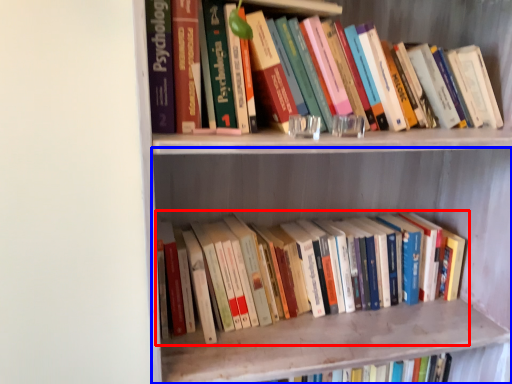
Question: Which point is further to the camera, book (highlighted by a red box) or shelf (highlighted by a blue box)?

Choices:
 (A) book
 (B) shelf

Answer: (A)